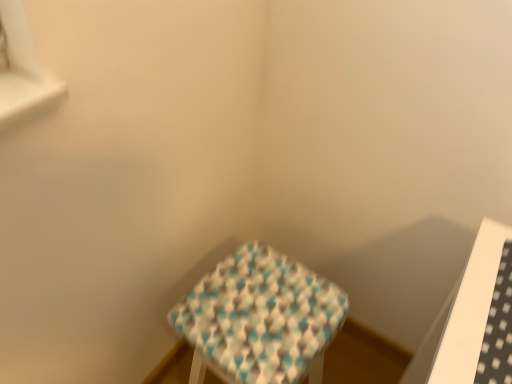
Where is `teal-patterned cushion at center`? teal-patterned cushion at center is located at coordinates (260, 318).

Describe the element at coordinates (260, 318) in the screenshot. The image size is (512, 384). I see `teal-patterned cushion at center` at that location.

Locate an element on the screen. teal-patterned cushion at center is located at coordinates (260, 318).